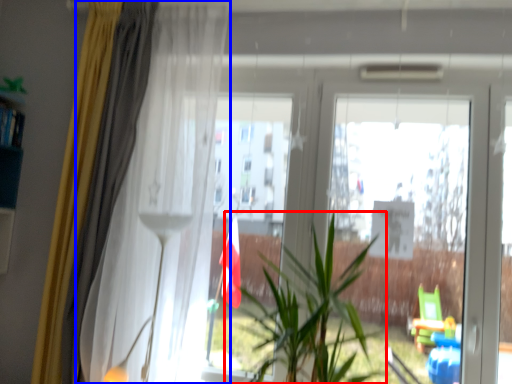
Question: Which object appears farthest to the camera in this image, houseplant (highlighted by a red box) or curtain (highlighted by a blue box)?

Choices:
 (A) houseplant
 (B) curtain

Answer: (B)